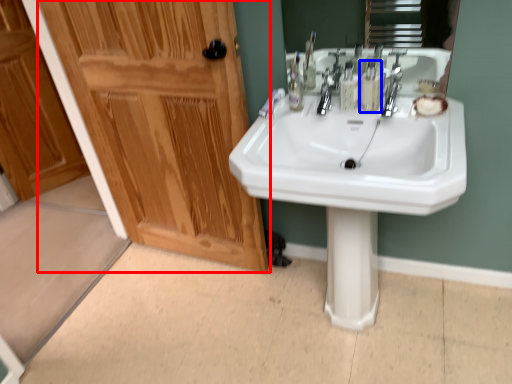
Question: Which object appears farthest to the camera in this image, door (highlighted by a red box) or mouthwash (highlighted by a blue box)?

Choices:
 (A) door
 (B) mouthwash

Answer: (B)